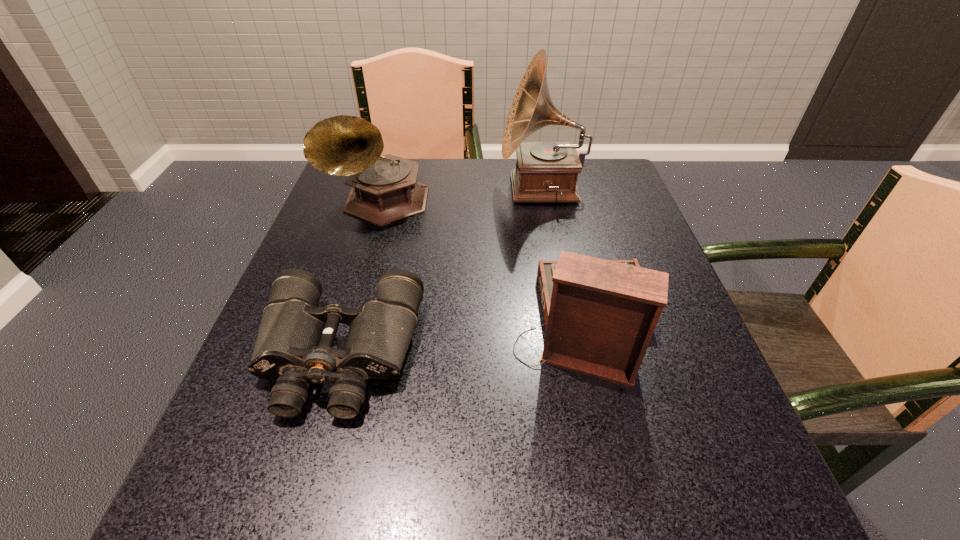
The height and width of the screenshot is (540, 960). Identify the location of empty space between the tallest object and the second tallest phonograph record. (461, 195).

The height and width of the screenshot is (540, 960). What are the coordinates of `object that is the second closest to the third tallest object` in the screenshot? It's located at (545, 171).

Where is `object identified as the third closest to the tallest phonograph record`? This screenshot has width=960, height=540. object identified as the third closest to the tallest phonograph record is located at coordinates (294, 344).

I want to click on phonograph record identified as the second closest to the leftmost phonograph record, so click(x=600, y=315).

Select which phonograph record appears as the second closest to the tallest object. Please provide its 2D coordinates. Your answer should be formatted as a tuple, i.e. [(x, y)], where the tuple contains the x and y coordinates of a point satisfying the conditions above.

[(600, 315)]

This screenshot has width=960, height=540. I want to click on free space that satisfies the following two spatial constraints: 1. on the horn of the tallest object; 2. on the horn direction of the leftmost phonograph record, so click(544, 202).

The width and height of the screenshot is (960, 540). What are the coordinates of `free region that satisfies the following two spatial constraints: 1. on the horn of the tallest object; 2. through the eyepieces of the binoculars` in the screenshot? It's located at (573, 354).

Where is `free space that satisfies the following two spatial constraints: 1. on the horn direction of the second tallest object; 2. on the right side of the shortest phonograph record`? The height and width of the screenshot is (540, 960). free space that satisfies the following two spatial constraints: 1. on the horn direction of the second tallest object; 2. on the right side of the shortest phonograph record is located at coordinates (344, 323).

You are a GUI agent. You are given a task and a screenshot of the screen. Output one action in this format:
    pyautogui.click(x=<x>, y=<y>)
    Task: Click on the vacant area in the image that satisfies the following two spatial constraints: 1. on the horn of the tallest phonograph record; 2. on the right side of the shortest phonograph record
    This screenshot has height=540, width=960.
    Given the screenshot: What is the action you would take?
    pyautogui.click(x=567, y=323)